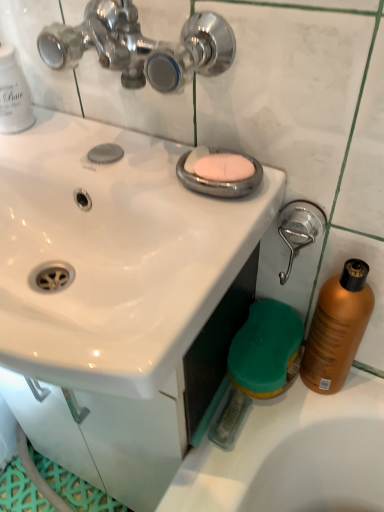
Identify the location of free spot to the left of pink matte soap at center. The width and height of the screenshot is (384, 512). (121, 153).